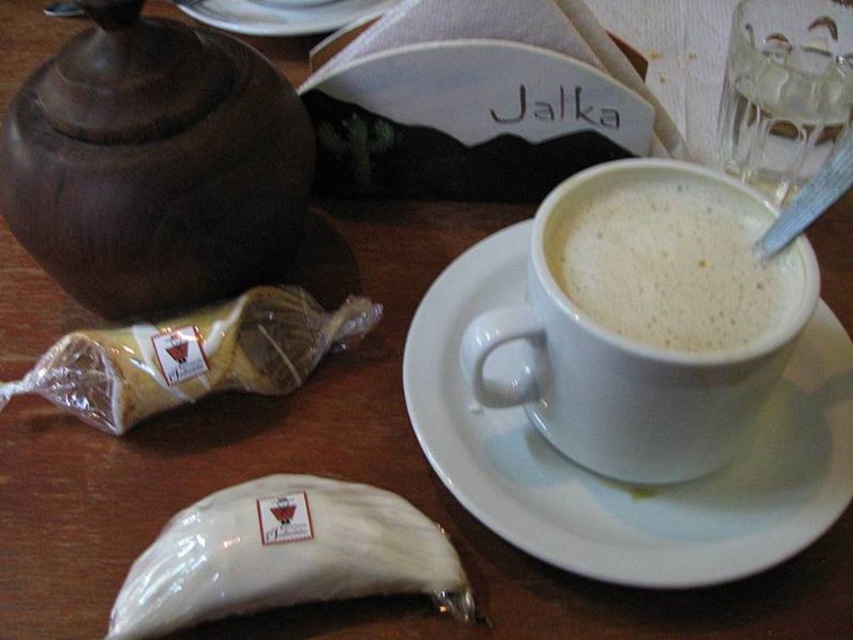
Question: Which of these objects is positioned closest to the golden-brown pastry at left?

Choices:
 (A) white glossy pastry at lower left
 (B) white ceramic plate at upper center
 (C) brown matte teapot at left

Answer: (C)

Question: Which point is farther from the camera taking this photo?

Choices:
 (A) (199, 522)
 (B) (556, 212)
 (C) (323, 17)

Answer: (C)

Question: Can you confirm if white ceramic saucer at center is wider than white frothy coffee at center?

Choices:
 (A) yes
 (B) no

Answer: (A)

Question: Can you confirm if brown matte teapot at left is positioned below golden-brown pastry at left?

Choices:
 (A) no
 (B) yes

Answer: (A)

Question: Can you confirm if white glossy pastry at lower left is positioned to the left of golden-brown pastry at left?

Choices:
 (A) no
 (B) yes

Answer: (A)

Question: Among these points, which one is nearest to the camera?

Choices:
 (A) (286, 29)
 (B) (277, 358)
 (C) (791, 516)

Answer: (C)